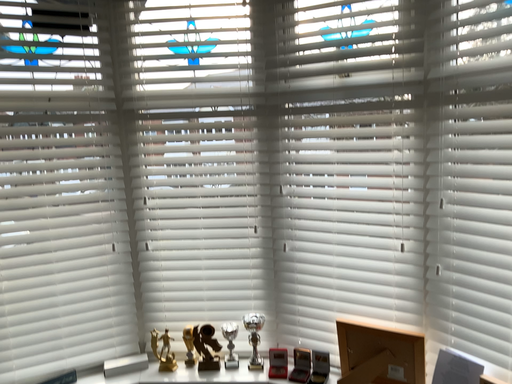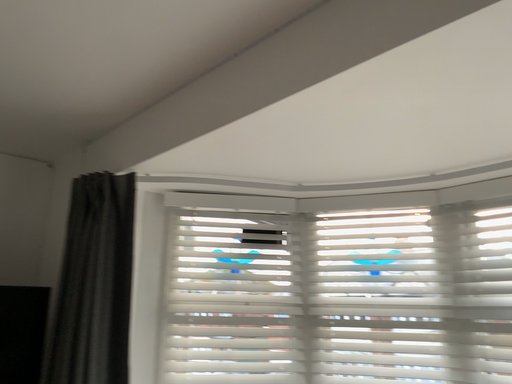
Question: Which way did the camera rotate in the video?

Choices:
 (A) rotated downward
 (B) rotated upward

Answer: (B)